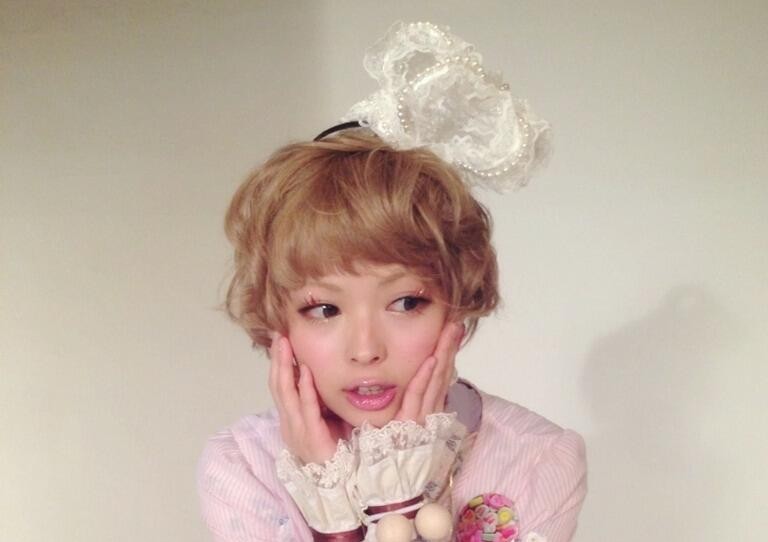
Locate an element on the screen. This screenshot has width=768, height=542. burgundy trim is located at coordinates (392, 503), (343, 533).